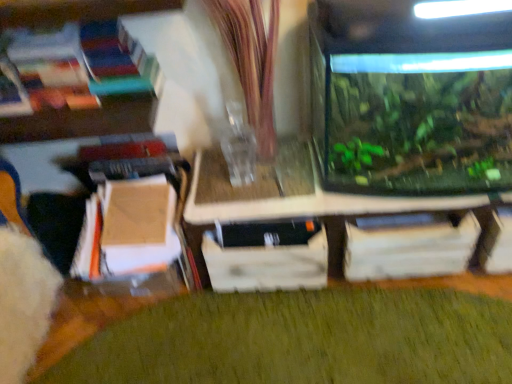
Question: Is transparent glass tank at center positioned in front of green matte plant at lower center?

Choices:
 (A) no
 (B) yes

Answer: (A)

Question: Can you confirm if transparent glass tank at center is shorter than green matte plant at lower center?

Choices:
 (A) yes
 (B) no

Answer: (B)

Question: Does transparent glass tank at center appear on the right side of green matte plant at lower center?

Choices:
 (A) yes
 (B) no

Answer: (A)

Question: Is transparent glass tank at center smaller than green matte plant at lower center?

Choices:
 (A) yes
 (B) no

Answer: (B)

Question: Does transparent glass tank at center touch green matte plant at lower center?

Choices:
 (A) yes
 (B) no

Answer: (B)

Question: Could you tell me if transparent glass tank at center is turned towards green matte plant at lower center?

Choices:
 (A) no
 (B) yes

Answer: (B)

Question: Is transparent glass tank at right not inside wooden drawer at center?

Choices:
 (A) yes
 (B) no

Answer: (A)

Question: From the image's perspective, does transparent glass tank at right appear higher than wooden drawer at center?

Choices:
 (A) yes
 (B) no

Answer: (A)

Question: Is transparent glass tank at right turned away from wooden drawer at center?

Choices:
 (A) yes
 (B) no

Answer: (B)

Question: Is transparent glass tank at right oriented towards wooden drawer at center?

Choices:
 (A) yes
 (B) no

Answer: (B)

Question: Is transparent glass tank at right with wooden drawer at center?

Choices:
 (A) yes
 (B) no

Answer: (B)

Question: From a real-world perspective, is transparent glass tank at right located beneath wooden drawer at center?

Choices:
 (A) yes
 (B) no

Answer: (B)

Question: From a real-world perspective, is transparent glass tank at center on transparent glass tank at right?

Choices:
 (A) yes
 (B) no

Answer: (B)